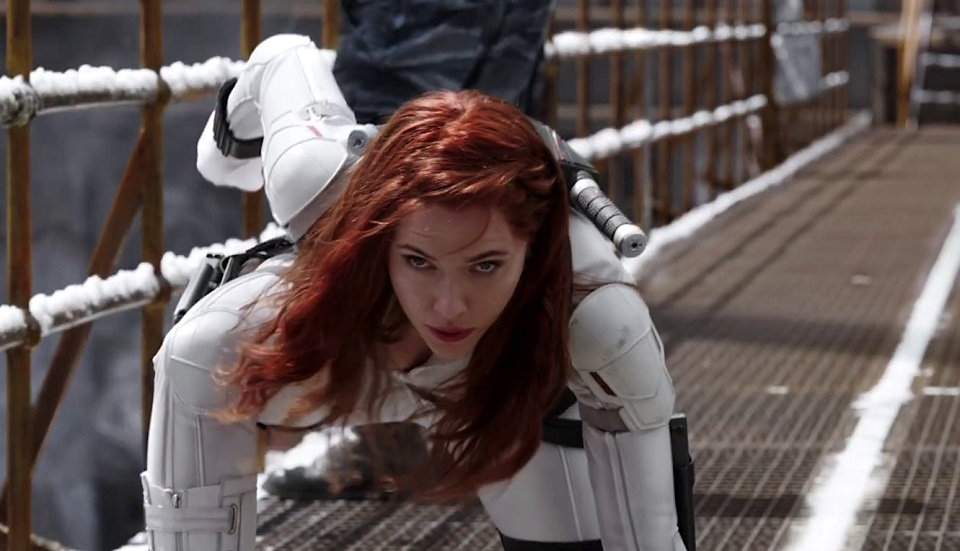
What are the coordinates of `handle` in the screenshot? It's located at (608, 213).